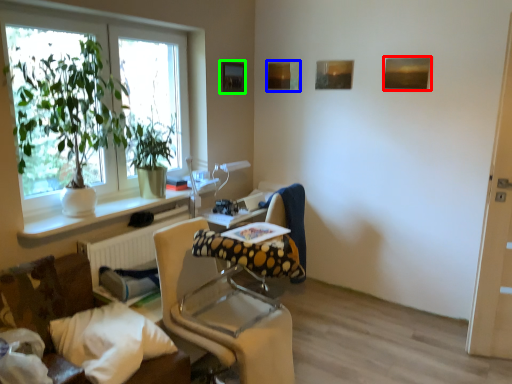
Question: Estimate the real-world distances between objects in this image. Which object is closer to picture frame (highlighted by a red box), picture frame (highlighted by a blue box) or picture frame (highlighted by a green box)?

Choices:
 (A) picture frame
 (B) picture frame

Answer: (A)